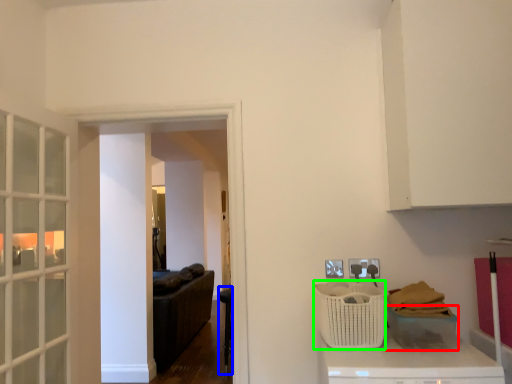
Question: Which object is the farthest from basket (highlighted by a red box)? Choose among these: furniture (highlighted by a blue box) or basket (highlighted by a green box).

Choices:
 (A) furniture
 (B) basket

Answer: (A)